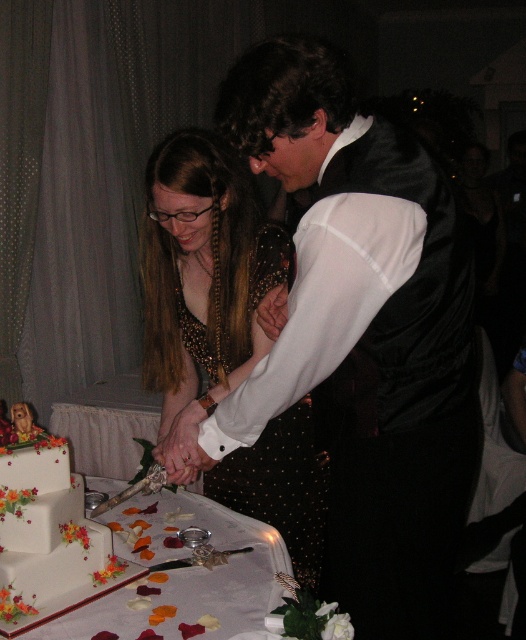
Which is above, white floral-decorated cake at lower left or black sequined dress at center?

black sequined dress at center is above.

Describe the element at coordinates (47, 532) in the screenshot. I see `white floral-decorated cake at lower left` at that location.

Is point (63, 586) positioned after point (282, 429)?

No, (63, 586) is in front of (282, 429).

I want to click on white floral-decorated cake at lower left, so click(x=47, y=532).

Looking at this image, can you confirm if matte black vest at center is shorter than white floral-decorated cake at lower left?

No, matte black vest at center is not shorter than white floral-decorated cake at lower left.

Which of these two, matte black vest at center or white floral-decorated cake at lower left, stands shorter?

With less height is white floral-decorated cake at lower left.

Between point (388, 333) and point (110, 580), which one is positioned in front?

Point (388, 333) is more forward.

At what (x,y) coordinates should I click in order to perform the action: click on matte black vest at center. Please return your answer as a coordinate pair (x, y). Looking at the image, I should click on coord(362,330).

Which of these two, matte black vest at center or black sequined dress at center, stands shorter?

black sequined dress at center

Which is in front, point (333, 582) or point (227, 502)?

Point (333, 582)

Find the location of `matte black vest at center`. matte black vest at center is located at coordinates (362, 330).